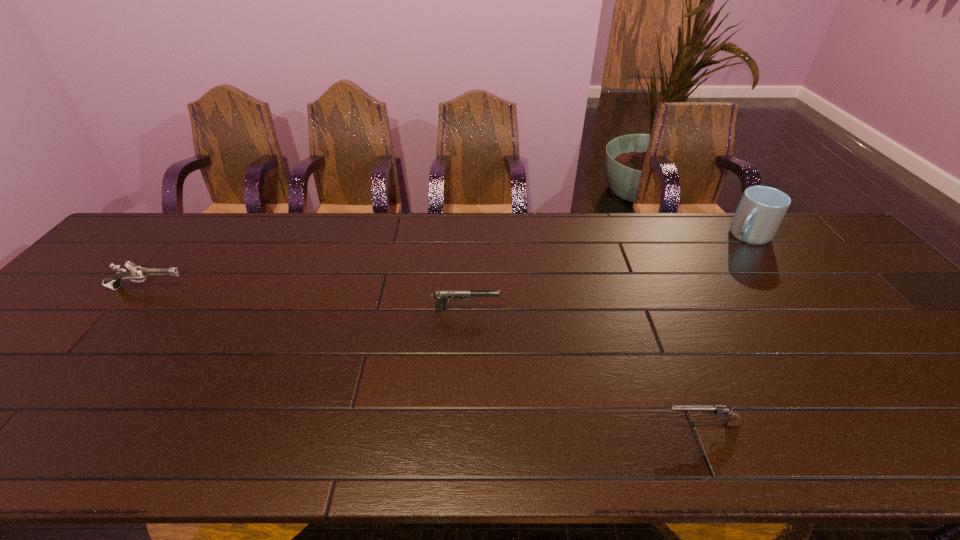
I want to click on free spot between the farthest object and the leftmost gun, so click(x=447, y=261).

This screenshot has height=540, width=960. Identify the location of free area in between the farthest object and the second tallest object. (447, 261).

You are a GUI agent. You are given a task and a screenshot of the screen. Output one action in this format:
    pyautogui.click(x=<x>, y=<y>)
    Task: Click on the free space between the mug and the nearest gun
    This screenshot has width=960, height=540.
    Given the screenshot: What is the action you would take?
    pyautogui.click(x=724, y=330)

Find the location of `vacant space that's between the farthest object and the second farthest gun`. vacant space that's between the farthest object and the second farthest gun is located at coordinates (607, 272).

The width and height of the screenshot is (960, 540). What are the coordinates of `blank region between the second gun from left to right and the rightmost gun` in the screenshot? It's located at (584, 367).

The width and height of the screenshot is (960, 540). What are the coordinates of `free spot between the farthest object and the leftmost gun` in the screenshot? It's located at (447, 261).

Where is `vacant area between the mug and the second gun from right to left`? This screenshot has width=960, height=540. vacant area between the mug and the second gun from right to left is located at coordinates (607, 272).

Where is `vacant space that's between the third shortest object and the second nearest gun`? vacant space that's between the third shortest object and the second nearest gun is located at coordinates (306, 299).

Find the location of a particular element. This screenshot has height=540, width=960. empty space that is in between the farthest object and the third nearest object is located at coordinates (447, 261).

Find the location of `vacant space that is in between the rightmost gun and the third nearest object`. vacant space that is in between the rightmost gun and the third nearest object is located at coordinates pyautogui.click(x=424, y=356).